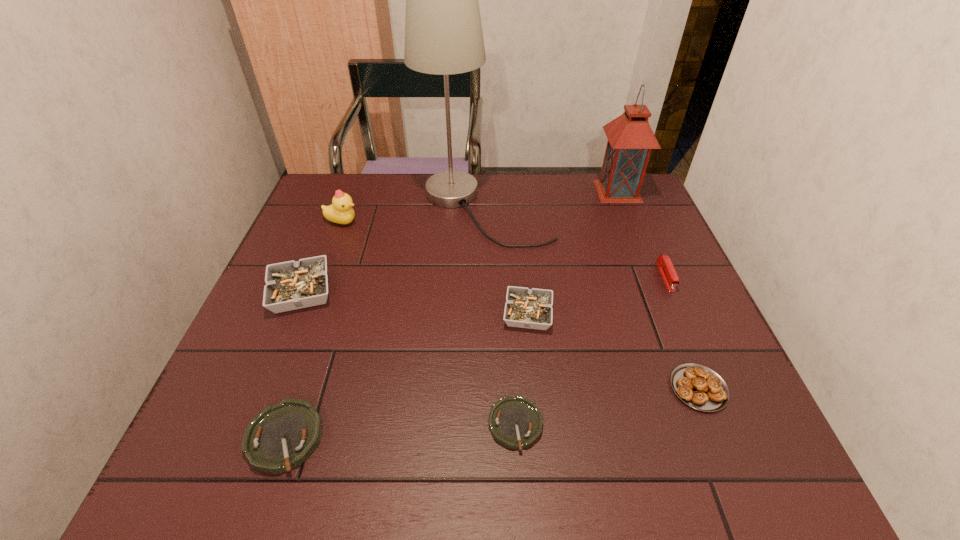
The width and height of the screenshot is (960, 540). Identify the location of free space located on the front-facing side of the red stapler. (682, 314).

This screenshot has width=960, height=540. In order to click on blank space located 0.240m on the front of the right gray ashtray in this screenshot , I will do `click(540, 437)`.

The image size is (960, 540). In order to click on free space located 0.400m on the back of the pastry in this screenshot , I will do `click(639, 243)`.

The height and width of the screenshot is (540, 960). I want to click on blank space located 0.240m on the right of the bigger green ashtray, so click(453, 437).

I want to click on vacant space located 0.060m on the back of the shortest ashtray, so click(513, 373).

The image size is (960, 540). Find the location of `table lamp present at the far edge`. table lamp present at the far edge is located at coordinates (443, 32).

Locate an element on the screen. The width and height of the screenshot is (960, 540). lantern positioned at the far edge is located at coordinates (630, 141).

Find the location of a particular element. duckling that is at the far edge is located at coordinates (340, 211).

This screenshot has width=960, height=540. In order to click on duckling that is positioned at the left edge in this screenshot , I will do (x=340, y=211).

Locate an element on the screen. This screenshot has width=960, height=540. lantern that is at the right edge is located at coordinates (630, 141).